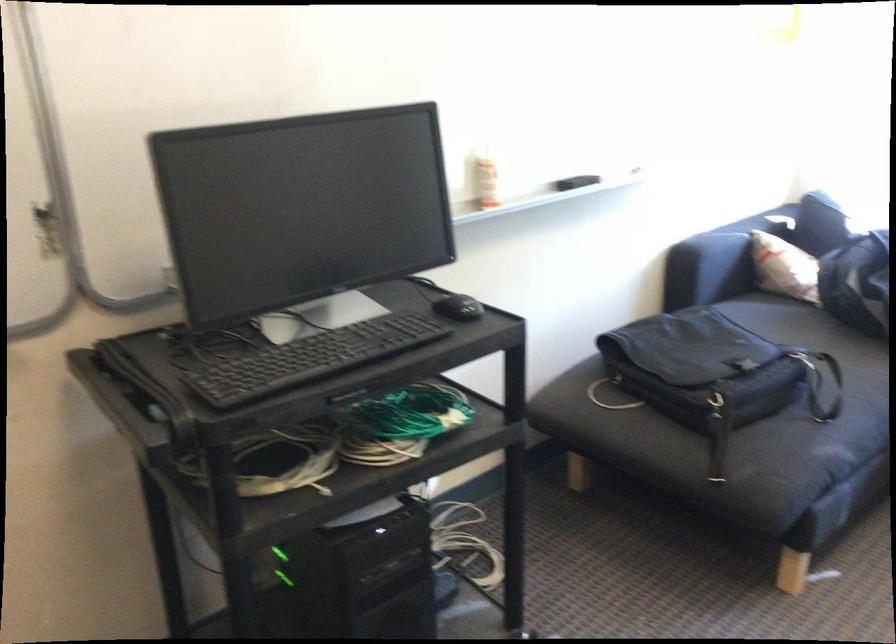
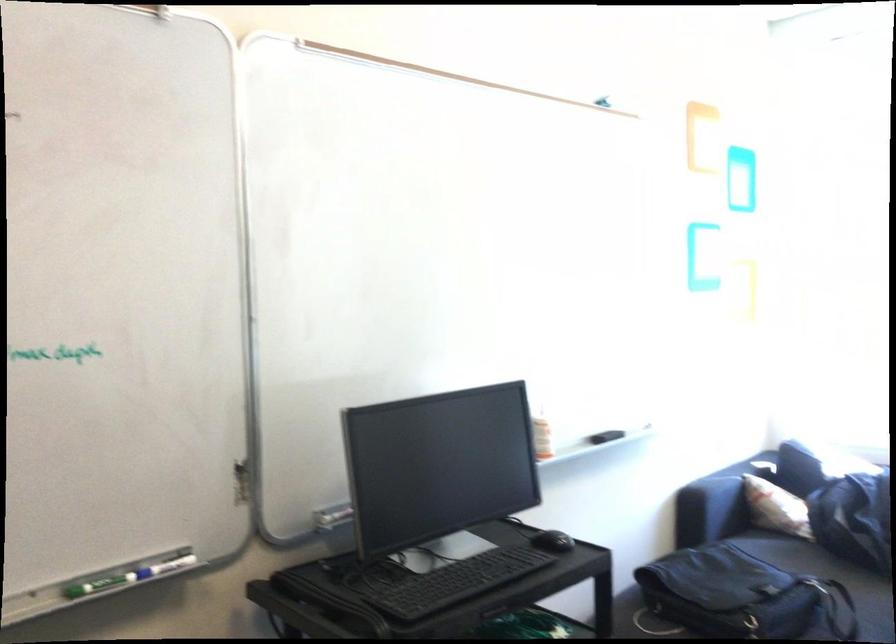
In the second image, find the point that corresponds to (815,348) in the first image.

(828, 576)